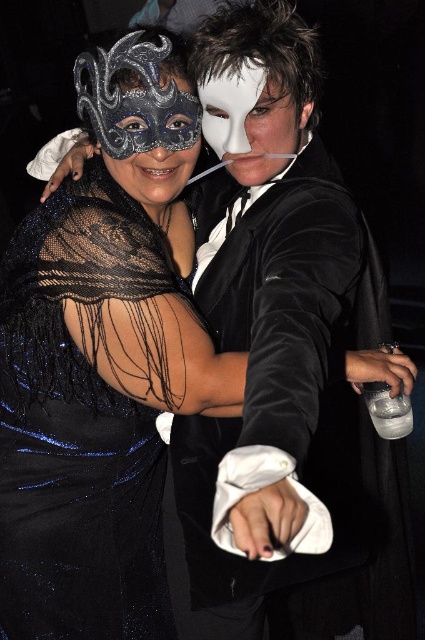
Can you confirm if black sequined dress at left is taller than white matte mask at center?

Correct, black sequined dress at left is much taller as white matte mask at center.

Is black sequined dress at left positioned in front of white matte mask at center?

No.

The height and width of the screenshot is (640, 425). Identify the location of black sequined dress at left. (79, 426).

Who is positioned more to the right, black sequined dress at left or metallic mask at center?

metallic mask at center is more to the right.

Is the position of black sequined dress at left less distant than that of metallic mask at center?

No, it is behind metallic mask at center.

Who is more distant from viewer, (73,442) or (133,161)?

Point (73,442)

Where is `black sequined dress at left`? This screenshot has width=425, height=640. black sequined dress at left is located at coordinates (79, 426).

Is white matte mask at center to the left of metallic mask at center from the viewer's perspective?

Incorrect, white matte mask at center is not on the left side of metallic mask at center.

Who is positioned more to the right, white matte mask at center or metallic mask at center?

white matte mask at center is more to the right.

Measure the distance between point (237, 125) and camera.

Point (237, 125) and camera are 1.19 meters apart from each other.

Image resolution: width=425 pixels, height=640 pixels. Identify the location of white matte mask at center. pos(237,120).